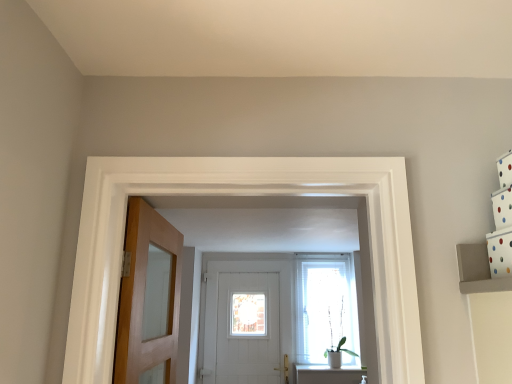
Question: Is point (142, 340) positioned closer to the camera than point (347, 274)?

Choices:
 (A) farther
 (B) closer

Answer: (B)

Question: From a real-world perspective, is light brown wooden door at left, the 2th door from the back, physically located above or below translucent fabric at center?

Choices:
 (A) above
 (B) below

Answer: (A)

Question: Which of these objects is positioned farthest from the translucent fabric at center?

Choices:
 (A) green matte plant at center
 (B) light brown wooden door at left, acting as the first door starting from the front
 (C) white wooden door at center, the 2th door viewed from the front

Answer: (B)

Question: Estimate the real-world distances between objects in this image. Which object is farther from the translucent fabric at center?

Choices:
 (A) white wooden door at center, the 2th door viewed from the front
 (B) light brown wooden door at left, the 2th door from the back
 (C) green matte plant at center

Answer: (B)